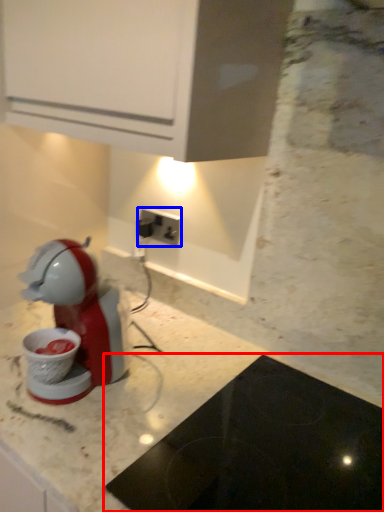
Question: Which of the following is the closest to the observer, home appliance (highlighted by a red box) or power plugs and sockets (highlighted by a blue box)?

Choices:
 (A) home appliance
 (B) power plugs and sockets

Answer: (A)